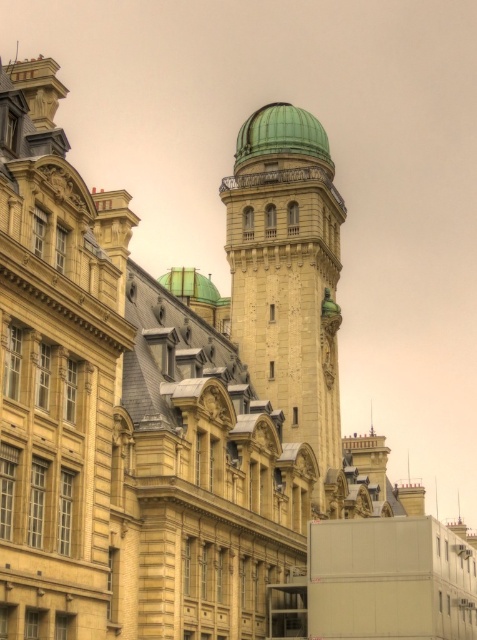
Between green dome at center and green polished dome at upper center, which one appears on the right side from the viewer's perspective?

green dome at center is more to the right.

Is point (291, 208) closer to viewer compared to point (290, 108)?

Yes, it is.

The image size is (477, 640). I want to click on green dome at center, so click(289, 280).

Is green dome at center bigger than green matte dome at upper center?

No, green dome at center is not bigger than green matte dome at upper center.

Is green dome at center taller than green matte dome at upper center?

Yes.

Where is `green dome at center`? Image resolution: width=477 pixels, height=640 pixels. green dome at center is located at coordinates (289, 280).

How far apart are green polished dome at upper center and green matte dome at upper center?

31.62 meters

Is green polished dome at upper center taller than green matte dome at upper center?

In fact, green polished dome at upper center may be shorter than green matte dome at upper center.

Is point (251, 115) positioned in front of point (182, 296)?

No, it is behind (182, 296).

Identify the location of green polished dome at upper center. The width and height of the screenshot is (477, 640). (281, 134).